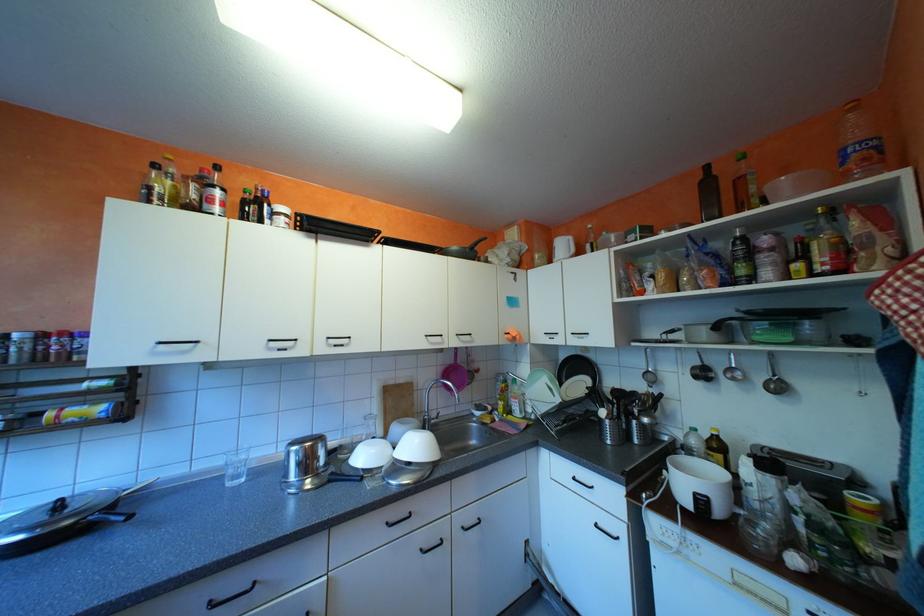
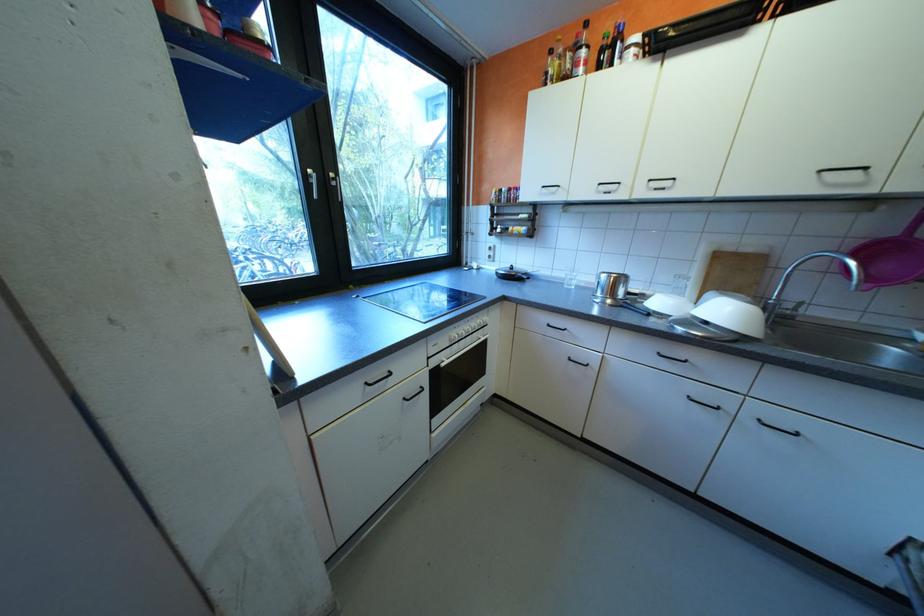
Locate, in the second image, the point that corresponds to point 469,532 in the first image.

(760, 419)